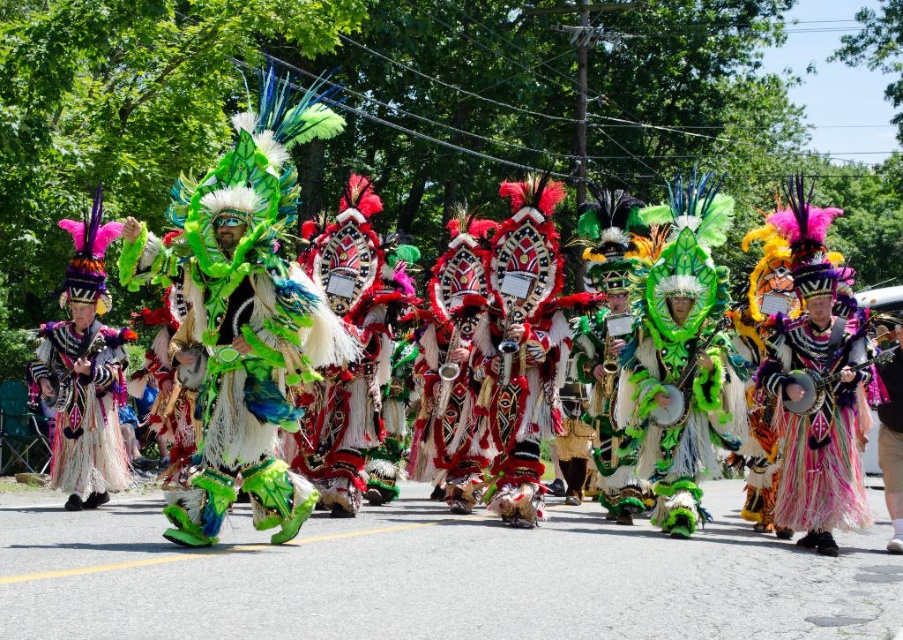
Question: Observing the image, what is the correct spatial positioning of shiny green feathers at center in reference to shiny metallic headdress at left?

Choices:
 (A) above
 (B) below

Answer: (A)

Question: Which object is farther from the camera taking this photo?

Choices:
 (A) shiny green feathers at center
 (B) multicolored feathered headdress at center

Answer: (B)

Question: Does multicolored feathered headdress at center appear under shiny metallic headdress at left?

Choices:
 (A) yes
 (B) no

Answer: (B)

Question: Which object appears farthest from the camera in this image?

Choices:
 (A) multicolored feathered headdress at center
 (B) shiny metallic headdress at left

Answer: (B)

Question: Which of the following is the farthest from the observer?

Choices:
 (A) multicolored feathered headdress at center
 (B) shiny green feathers at center
 (C) shiny metallic headdress at left

Answer: (C)

Question: Is the position of shiny green feathers at center more distant than that of multicolored feathered headdress at center?

Choices:
 (A) no
 (B) yes

Answer: (A)